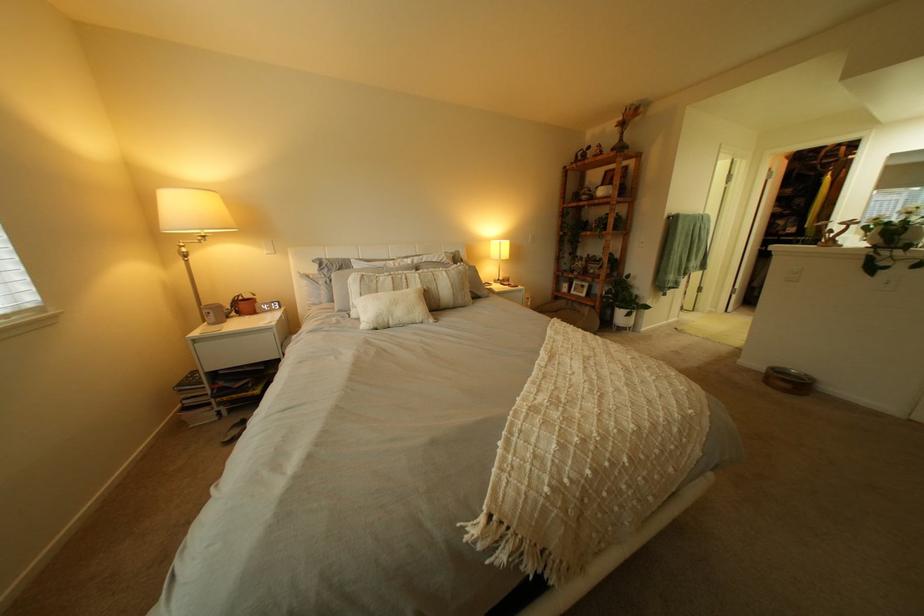
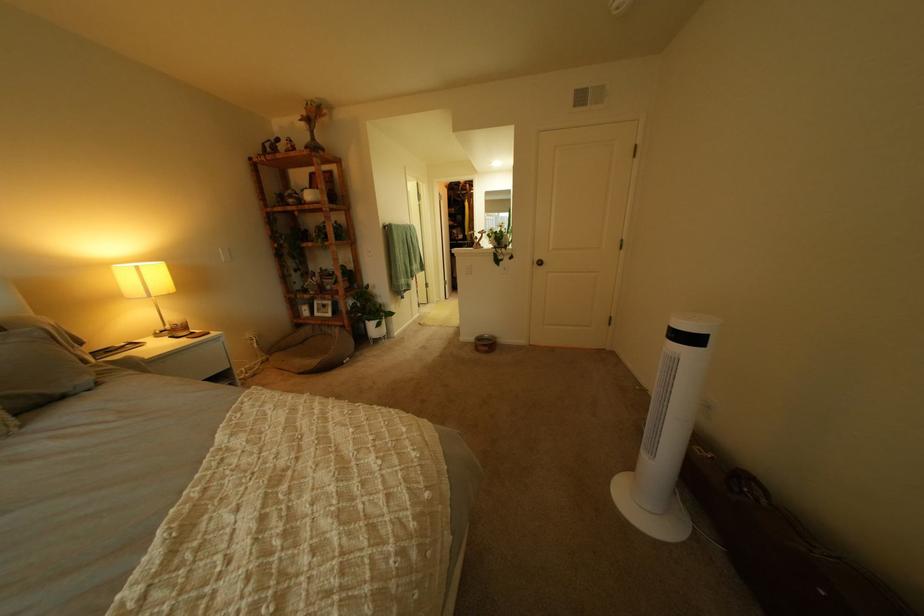
Where in the second image is the point corresponding to the point at 504,297 from the first image?

(115, 385)